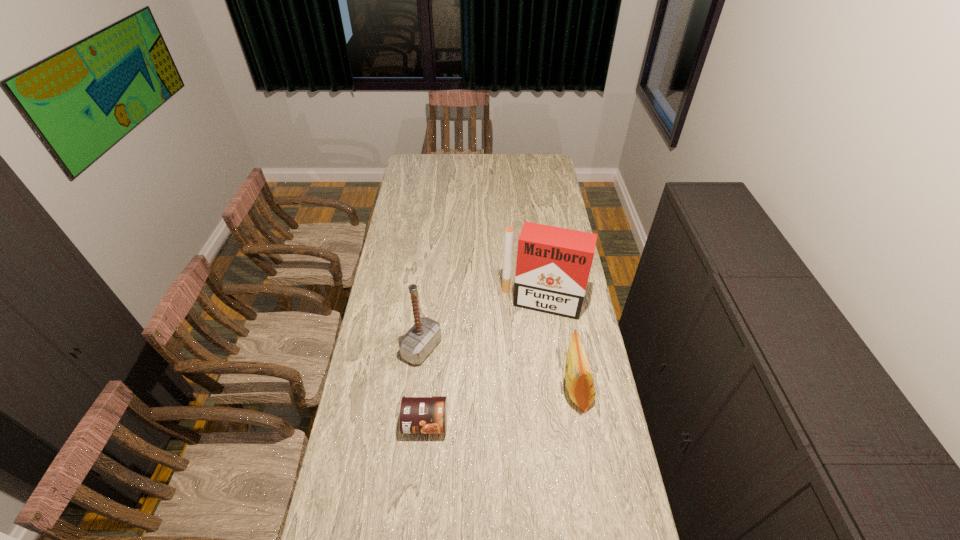
I want to click on can, so click(x=418, y=414).

Where is `crisp (potato chip)`? The width and height of the screenshot is (960, 540). crisp (potato chip) is located at coordinates (579, 380).

Where is `cigarette case`? This screenshot has width=960, height=540. cigarette case is located at coordinates (553, 265).

What are the coordinates of `the second farthest object` in the screenshot? It's located at (425, 334).

Locate an element on the screen. This screenshot has height=540, width=960. free location located 0.100m on the front label of the shortest object is located at coordinates (421, 471).

This screenshot has width=960, height=540. In order to click on blank space located 0.380m on the front-facing side of the farthest object in this screenshot , I will do `click(512, 399)`.

Locate an element on the screen. vacant area situated on the front-facing side of the farthest object is located at coordinates (524, 352).

The image size is (960, 540). I want to click on vacant space located 0.290m on the front-facing side of the farthest object, so click(517, 378).

Find the location of a particular element. The width and height of the screenshot is (960, 540). free region located 0.060m on the striking surface of the third nearest object is located at coordinates (451, 365).

You are a GUI agent. You are given a task and a screenshot of the screen. Output one action in this format:
    pyautogui.click(x=<x>, y=<y>)
    Task: Click on the free space located on the striking surface of the third nearest object
    
    Given the screenshot: What is the action you would take?
    pyautogui.click(x=509, y=396)